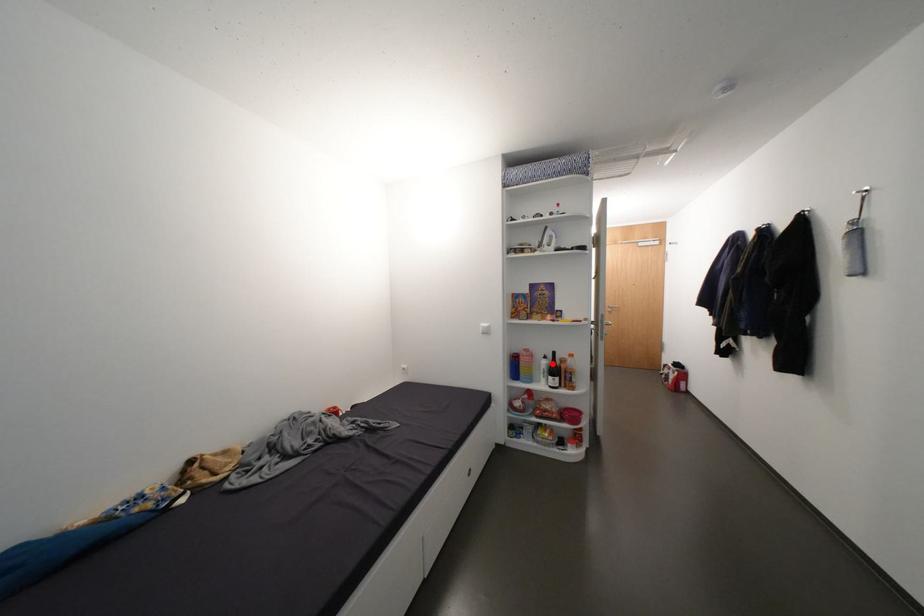
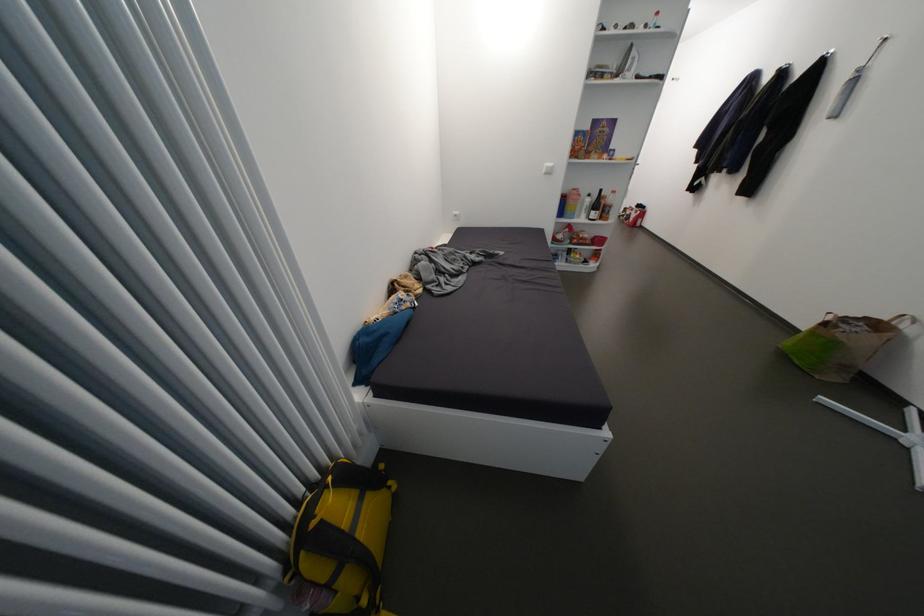
Question: I am providing you with two images of the same scene from different viewpoints. Given a red point in image1, look at the same physical point in image2. Is it:

Choices:
 (A) Closer to the viewpoint
 (B) Farther from the viewpoint

Answer: (A)